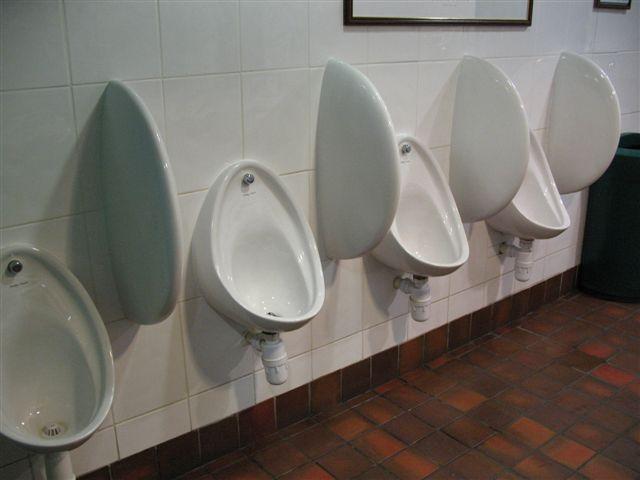
I want to click on dividers between urinals, so click(x=166, y=236), click(x=361, y=185), click(x=500, y=164), click(x=577, y=153).